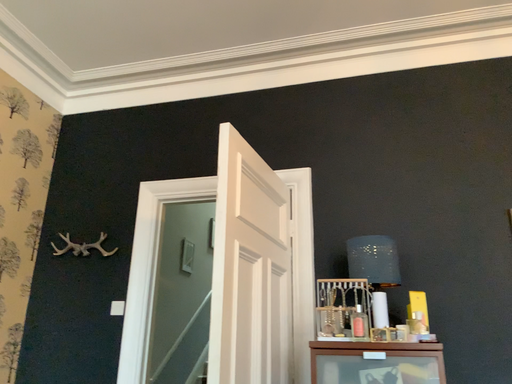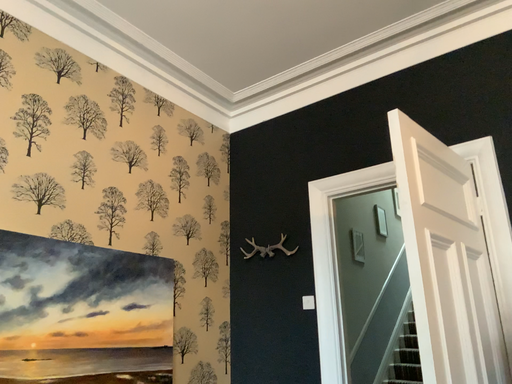
Question: Which way did the camera rotate in the video?

Choices:
 (A) rotated right
 (B) rotated left

Answer: (B)